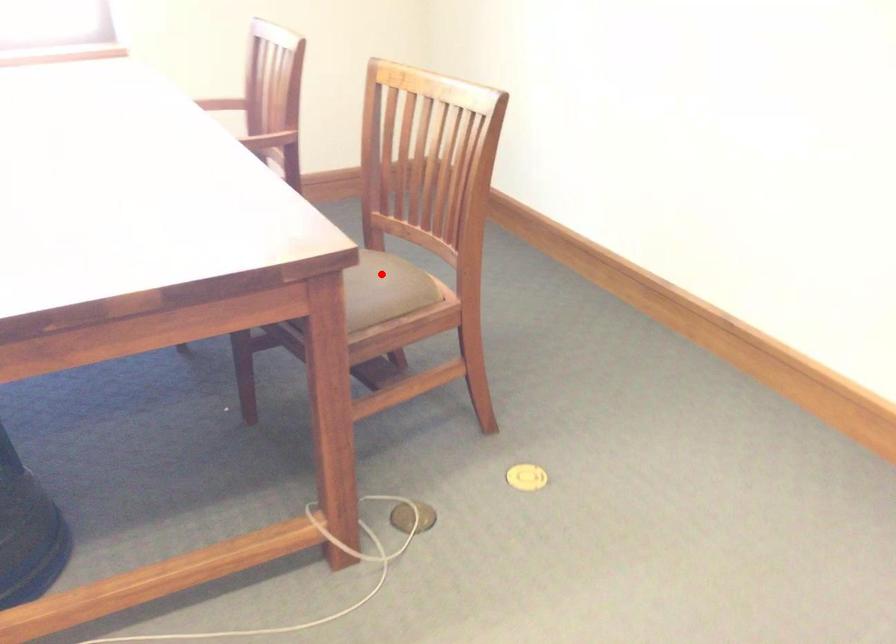
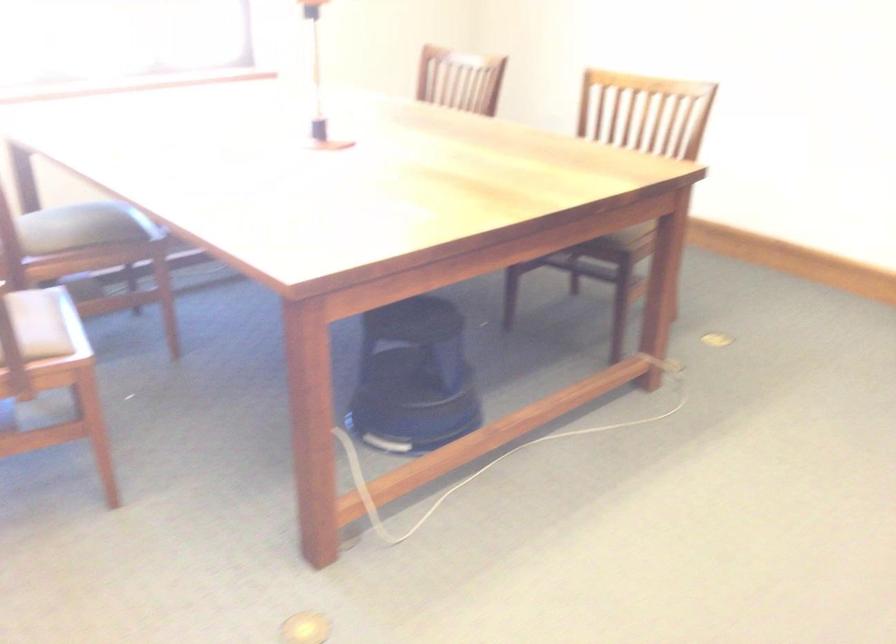
Question: I am providing you with two images of the same scene from different viewpoints. A red point is marked on the first image. Is the red point's position out of view in image 2?

Choices:
 (A) Yes
 (B) No

Answer: (A)